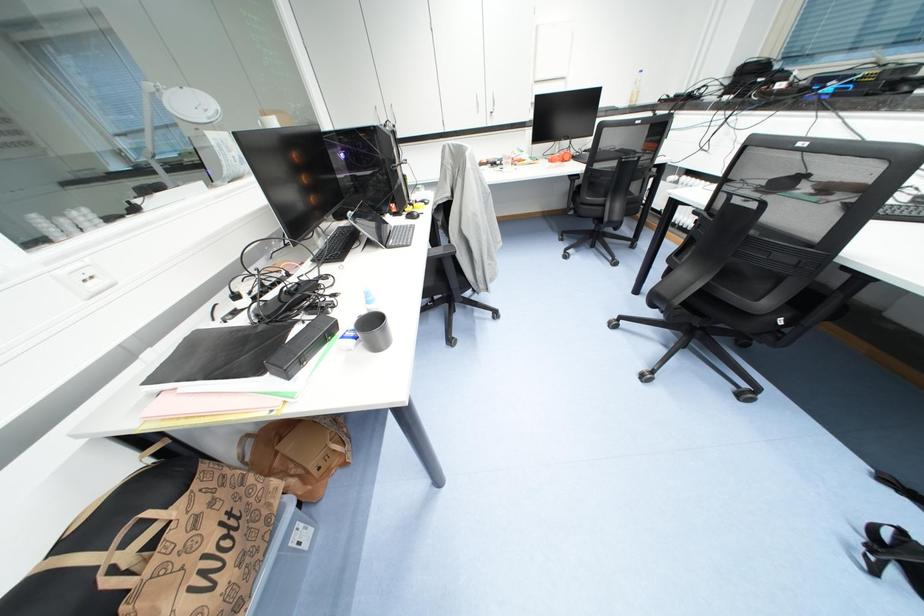
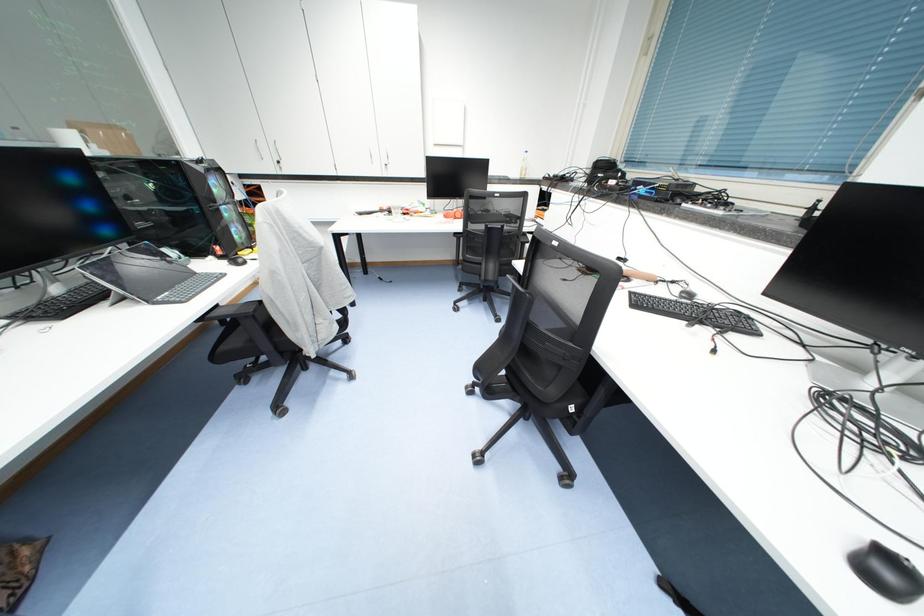
Question: In a continuous first-person perspective shot, in which direction is the camera moving?

Choices:
 (A) Left
 (B) Right
 (C) Forward
 (D) Backward

Answer: (B)